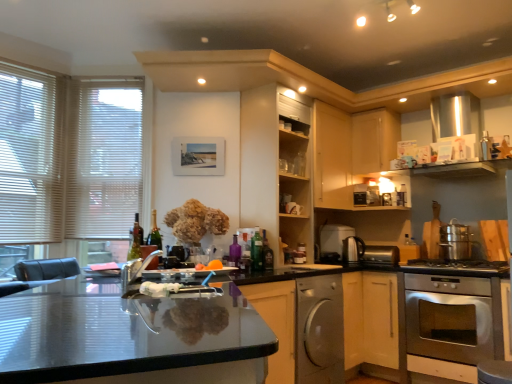
Question: Considering the positions of stainless steel oven at lower right and brushed metal faucet at center, which appears as the 4th appliance when viewed from the right, in the image, is stainless steel oven at lower right bigger or smaller than brushed metal faucet at center, which appears as the 4th appliance when viewed from the right,?

Choices:
 (A) big
 (B) small

Answer: (A)

Question: In terms of height, does stainless steel oven at lower right look taller or shorter compared to brushed metal faucet at center, the 1th appliance from the left?

Choices:
 (A) tall
 (B) short

Answer: (A)

Question: Which is nearer to the shiny metallic kettle at right, positioned as the third appliance in back-to-front order?

Choices:
 (A) light wood cabinet at upper right, which is the 3th cabinetry in left-to-right order
 (B) translucent glass bottle at center, which is the 1th bottle from left to right
 (C) satin silver dishwasher at lower center
 (D) orange matte fruit at center
 (E) wooden shelves at center, marked as the first cabinetry in a left-to-right arrangement

Answer: (A)

Question: Which of these objects is positioned farthest from the satin silver toaster at lower center, positioned as the 1th appliance in back-to-front order?

Choices:
 (A) green glass bottle at center, marked as the third bottle in a left-to-right arrangement
 (B) orange matte fruit at center
 (C) green glass wine bottle at left
 (D) brushed metal faucet at center, arranged as the fourth appliance when viewed from the back
 (E) satin silver dishwasher at lower center

Answer: (D)